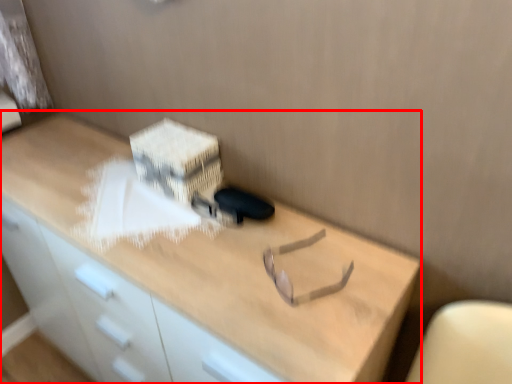
Question: From the image's perspective, what is the correct spatial relationship of desk (annotated by the red box) in relation to cardboard box?

Choices:
 (A) below
 (B) above

Answer: (A)